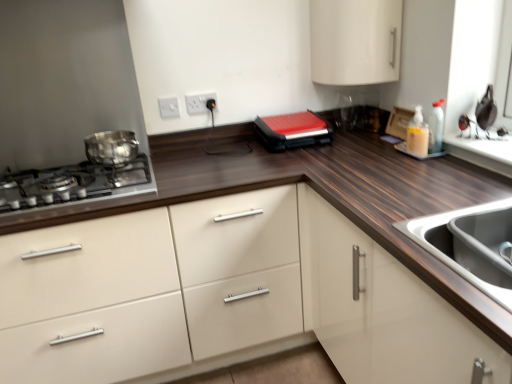
At what (x,y) coordinates should I click in order to perform the action: click on white glossy cabinet at upper center, arranged as the 1th cabinetry when viewed from the top. Please return your answer as a coordinate pair (x, y). The image size is (512, 384). Looking at the image, I should click on (355, 41).

Image resolution: width=512 pixels, height=384 pixels. Describe the element at coordinates (355, 41) in the screenshot. I see `white glossy cabinet at upper center, arranged as the 1th cabinetry when viewed from the top` at that location.

What do you see at coordinates (168, 107) in the screenshot? I see `white plastic electric outlet at upper center, positioned as the first electric outlet in left-to-right order` at bounding box center [168, 107].

The height and width of the screenshot is (384, 512). Describe the element at coordinates (200, 102) in the screenshot. I see `white plastic electric outlet at upper center, which is counted as the 1th electric outlet, starting from the right` at that location.

What do you see at coordinates (111, 147) in the screenshot? I see `shiny metallic pot at left` at bounding box center [111, 147].

Measure the distance between translucent plastic soap dispenser at upper right and camera.

translucent plastic soap dispenser at upper right is 1.68 meters from camera.

Locate an element on the screen. white glossy cabinet at upper center, placed as the 2th cabinetry when sorted from bottom to top is located at coordinates (355, 41).

Who is smaller, white plastic electric outlet at upper center, positioned as the first electric outlet in left-to-right order, or red matte sandwich maker at center?

With smaller size is white plastic electric outlet at upper center, positioned as the first electric outlet in left-to-right order.

Considering the relative sizes of white plastic electric outlet at upper center, positioned as the 2th electric outlet in right-to-left order, and red matte sandwich maker at center in the image provided, is white plastic electric outlet at upper center, positioned as the 2th electric outlet in right-to-left order, taller than red matte sandwich maker at center?

No.

Could you measure the distance between white plastic electric outlet at upper center, positioned as the 2th electric outlet in right-to-left order, and red matte sandwich maker at center?

white plastic electric outlet at upper center, positioned as the 2th electric outlet in right-to-left order, is 21.09 inches away from red matte sandwich maker at center.

Could you tell me if white plastic electric outlet at upper center, positioned as the 2th electric outlet in right-to-left order, is turned towards red matte sandwich maker at center?

No, white plastic electric outlet at upper center, positioned as the 2th electric outlet in right-to-left order, is not turned towards red matte sandwich maker at center.

Looking at this image, considering the relative sizes of white glossy cabinet at upper center, placed as the 2th cabinetry when sorted from bottom to top, and shiny metallic gas stove at left in the image provided, is white glossy cabinet at upper center, placed as the 2th cabinetry when sorted from bottom to top, bigger than shiny metallic gas stove at left?

Correct, white glossy cabinet at upper center, placed as the 2th cabinetry when sorted from bottom to top, is larger in size than shiny metallic gas stove at left.

Looking at this image, can you tell me how much white glossy cabinet at upper center, placed as the 2th cabinetry when sorted from bottom to top, and shiny metallic gas stove at left differ in facing direction?

The angle between the facing direction of white glossy cabinet at upper center, placed as the 2th cabinetry when sorted from bottom to top, and the facing direction of shiny metallic gas stove at left is 40 degrees.

How distant is white glossy cabinet at upper center, arranged as the 1th cabinetry when viewed from the top, from shiny metallic gas stove at left?

A distance of 3.66 feet exists between white glossy cabinet at upper center, arranged as the 1th cabinetry when viewed from the top, and shiny metallic gas stove at left.

Which object is wider, white glossy cabinet at upper center, arranged as the 1th cabinetry when viewed from the top, or shiny metallic gas stove at left?

shiny metallic gas stove at left is wider.

How much distance is there between white plastic electric outlet at upper center, which is counted as the 1th electric outlet, starting from the right, and white glossy cabinet at center, which ranks as the 1th cabinetry in bottom-to-top order?

They are 38.29 inches apart.

Could you tell me if white plastic electric outlet at upper center, which is counted as the 1th electric outlet, starting from the right, is turned towards white glossy cabinet at center, the 2th cabinetry viewed from the top?

No, white plastic electric outlet at upper center, which is counted as the 1th electric outlet, starting from the right, is not oriented towards white glossy cabinet at center, the 2th cabinetry viewed from the top.

Which object is closer to the camera taking this photo, white plastic electric outlet at upper center, which is counted as the 1th electric outlet, starting from the right, or white glossy cabinet at center, the 2th cabinetry viewed from the top?

white glossy cabinet at center, the 2th cabinetry viewed from the top, is in front.

From the image's perspective, does white plastic electric outlet at upper center, the second electric outlet when ordered from left to right, appear lower than white glossy cabinet at center, the 2th cabinetry viewed from the top?

No, from the image's perspective, white plastic electric outlet at upper center, the second electric outlet when ordered from left to right, is not below white glossy cabinet at center, the 2th cabinetry viewed from the top.

Looking at their sizes, would you say shiny metallic gas stove at left is wider or thinner than red matte sandwich maker at center?

Considering their sizes, shiny metallic gas stove at left looks broader than red matte sandwich maker at center.

Between shiny metallic gas stove at left and red matte sandwich maker at center, which one has smaller size?

With smaller size is red matte sandwich maker at center.

From the image's perspective, is shiny metallic gas stove at left positioned above or below red matte sandwich maker at center?

shiny metallic gas stove at left is situated lower than red matte sandwich maker at center in the image.

Is shiny metallic gas stove at left next to red matte sandwich maker at center?

shiny metallic gas stove at left and red matte sandwich maker at center are not in contact.

At what (x,y) coordinates should I click in order to perform the action: click on gas stove above the stainless steel sink at lower right (from a real-world perspective). Please return your answer as a coordinate pair (x, y). The image size is (512, 384). Looking at the image, I should click on (74, 184).

Is shiny metallic gas stove at left at the right side of stainless steel sink at lower right?

No.

From the image's perspective, is shiny metallic gas stove at left above or below stainless steel sink at lower right?

From the image's perspective, shiny metallic gas stove at left appears above stainless steel sink at lower right.

Is stainless steel sink at lower right located within shiny metallic gas stove at left?

Actually, stainless steel sink at lower right is outside shiny metallic gas stove at left.

In the scene shown: Is the position of red matte sandwich maker at center less distant than that of white glossy cabinet at upper center, placed as the 2th cabinetry when sorted from bottom to top?

No, it is behind white glossy cabinet at upper center, placed as the 2th cabinetry when sorted from bottom to top.

Does red matte sandwich maker at center have a larger size compared to white glossy cabinet at upper center, placed as the 2th cabinetry when sorted from bottom to top?

Actually, red matte sandwich maker at center might be smaller than white glossy cabinet at upper center, placed as the 2th cabinetry when sorted from bottom to top.

Is there a large distance between red matte sandwich maker at center and white glossy cabinet at upper center, arranged as the 1th cabinetry when viewed from the top?

They are positioned close to each other.

Is point (307, 138) more distant than point (376, 27)?

Yes, it is behind point (376, 27).

Is point (216, 103) more distant than point (425, 243)?

Yes.

How different are the orientations of white plastic electric outlet at upper center, the second electric outlet when ordered from left to right, and stainless steel sink at lower right in degrees?

The angle between the facing direction of white plastic electric outlet at upper center, the second electric outlet when ordered from left to right, and the facing direction of stainless steel sink at lower right is 91 degrees.

Looking at their sizes, would you say white plastic electric outlet at upper center, the second electric outlet when ordered from left to right, is wider or thinner than stainless steel sink at lower right?

Considering their sizes, white plastic electric outlet at upper center, the second electric outlet when ordered from left to right, looks slimmer than stainless steel sink at lower right.

This screenshot has width=512, height=384. Find the location of `kitchen appliance located underneath the white plastic electric outlet at upper center, positioned as the first electric outlet in left-to-right order (from a real-world perspective)`. kitchen appliance located underneath the white plastic electric outlet at upper center, positioned as the first electric outlet in left-to-right order (from a real-world perspective) is located at coordinates pyautogui.click(x=292, y=131).

At what (x,y) coordinates should I click in order to perform the action: click on cabinetry above the shiny metallic gas stove at left (from a real-world perspective). Please return your answer as a coordinate pair (x, y). Looking at the image, I should click on (355, 41).

From the picture: Considering their positions, is shiny metallic pot at left positioned closer to white plastic electric outlet at upper center, the second electric outlet when ordered from left to right, than white glossy cabinet at center, the 2th cabinetry viewed from the top?

shiny metallic pot at left.

Considering their positions, is shiny metallic pot at left positioned closer to stainless steel sink at lower right than white glossy cabinet at upper center, placed as the 2th cabinetry when sorted from bottom to top?

white glossy cabinet at upper center, placed as the 2th cabinetry when sorted from bottom to top, is positioned closer to the anchor stainless steel sink at lower right.

From the image, which object appears to be nearer to shiny metallic pot at left, stainless steel sink at lower right or white glossy cabinet at upper center, placed as the 2th cabinetry when sorted from bottom to top?

white glossy cabinet at upper center, placed as the 2th cabinetry when sorted from bottom to top, is positioned closer to the anchor shiny metallic pot at left.

Looking at this image, estimate the real-world distances between objects in this image. Which object is further from red matte sandwich maker at center, white glossy cabinet at upper center, arranged as the 1th cabinetry when viewed from the top, or white plastic electric outlet at upper center, positioned as the 2th electric outlet in right-to-left order?

Based on the image, white plastic electric outlet at upper center, positioned as the 2th electric outlet in right-to-left order, appears to be further to red matte sandwich maker at center.

When comparing their distances from red matte sandwich maker at center, does shiny metallic pot at left or white plastic electric outlet at upper center, positioned as the first electric outlet in left-to-right order, seem further?

shiny metallic pot at left is positioned further to the anchor red matte sandwich maker at center.

When comparing their distances from shiny metallic gas stove at left, does stainless steel sink at lower right or white glossy cabinet at upper center, placed as the 2th cabinetry when sorted from bottom to top, seem closer?

stainless steel sink at lower right is positioned closer to the anchor shiny metallic gas stove at left.

Looking at the image, which one is located closer to translucent plastic soap dispenser at upper right, white glossy cabinet at upper center, arranged as the 1th cabinetry when viewed from the top, or white plastic electric outlet at upper center, positioned as the first electric outlet in left-to-right order?

white glossy cabinet at upper center, arranged as the 1th cabinetry when viewed from the top, is positioned closer to the anchor translucent plastic soap dispenser at upper right.

Based on their spatial positions, is white plastic electric outlet at upper center, the second electric outlet when ordered from left to right, or stainless steel sink at lower right closer to white glossy cabinet at upper center, placed as the 2th cabinetry when sorted from bottom to top?

white plastic electric outlet at upper center, the second electric outlet when ordered from left to right, is positioned closer to the anchor white glossy cabinet at upper center, placed as the 2th cabinetry when sorted from bottom to top.

Identify the location of sink between white plastic electric outlet at upper center, positioned as the 2th electric outlet in right-to-left order, and translucent plastic soap dispenser at upper right from left to right. The image size is (512, 384). (447, 255).

Image resolution: width=512 pixels, height=384 pixels. What are the coordinates of `home appliance between shiny metallic gas stove at left and stainless steel sink at lower right in the horizontal direction` in the screenshot? It's located at (111, 147).

Where is `electric outlet positioned between white glossy cabinet at center, which ranks as the 1th cabinetry in bottom-to-top order, and white plastic electric outlet at upper center, the second electric outlet when ordered from left to right, from near to far`? electric outlet positioned between white glossy cabinet at center, which ranks as the 1th cabinetry in bottom-to-top order, and white plastic electric outlet at upper center, the second electric outlet when ordered from left to right, from near to far is located at coordinates [168, 107].

Find the location of a particular element. The width and height of the screenshot is (512, 384). kitchen appliance between white plastic electric outlet at upper center, positioned as the 2th electric outlet in right-to-left order, and translucent plastic soap dispenser at upper right is located at coordinates (292, 131).